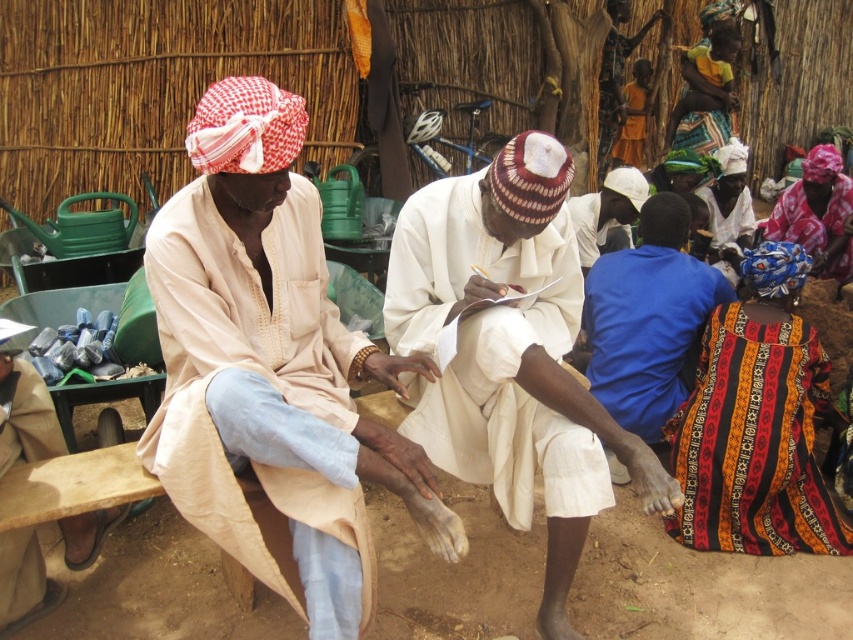
In the scene described, there is a blue cotton shirt at lower right and a white cloth at center. From the perspective of an observer facing the image, which object is positioned to the right of the other?

The blue cotton shirt at lower right is to the right of the white cloth at center.

You are a photographer trying to capture the scene with both the patterned fabric headscarf at upper right and the orange fabric dress at upper center in the frame. Based on their positions, which object should you focus on first to ensure both are in the shot?

The patterned fabric headscarf at upper right is below the orange fabric dress at upper center, so you should focus on the orange fabric dress at upper center first to ensure both are in the frame.